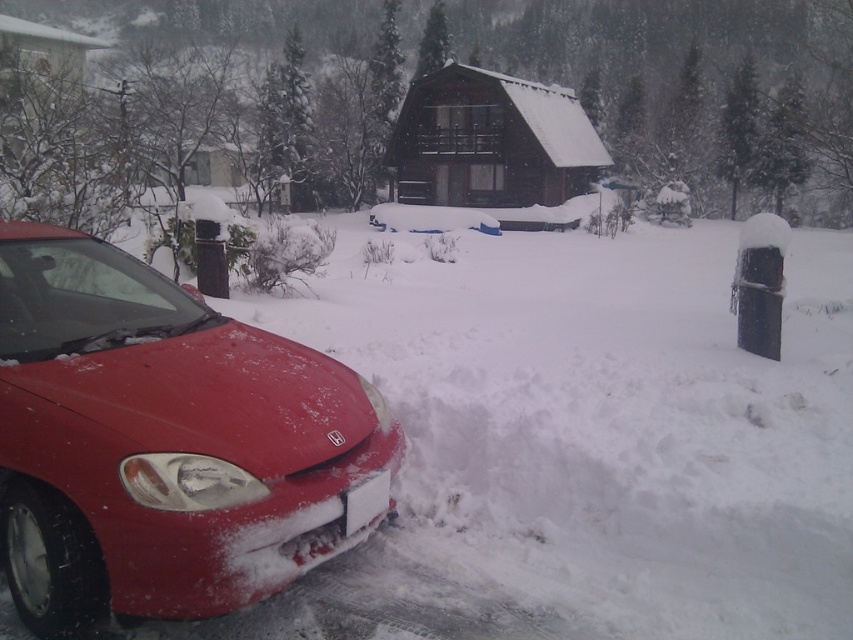
Question: Is smooth wooden cabin at upper center smaller than white plastic license plate at lower center?

Choices:
 (A) no
 (B) yes

Answer: (A)

Question: Considering the real-world distances, which object is farthest from the white plastic license plate at lower center?

Choices:
 (A) smooth wooden cabin at upper center
 (B) wooden cabin at center

Answer: (B)

Question: Which object is the farthest from the white plastic license plate at lower center?

Choices:
 (A) wooden cabin at center
 (B) matte red car at lower left
 (C) smooth wooden cabin at upper center

Answer: (A)

Question: Can you confirm if matte red car at lower left is positioned below smooth wooden cabin at upper center?

Choices:
 (A) yes
 (B) no

Answer: (A)

Question: Which object is farther from the camera taking this photo?

Choices:
 (A) matte red car at lower left
 (B) smooth wooden cabin at upper center
 (C) wooden cabin at center
 (D) white plastic license plate at lower center

Answer: (C)

Question: Does smooth wooden cabin at upper center come behind white plastic license plate at lower center?

Choices:
 (A) yes
 (B) no

Answer: (A)